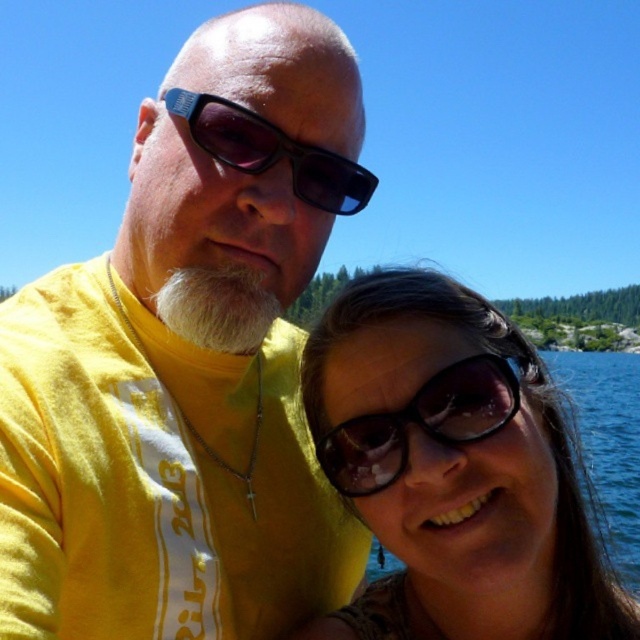
Question: Which of these objects is positioned closest to the matte black sunglasses at upper center?

Choices:
 (A) white fuzzy beard at center
 (B) sunglasses at center
 (C) yellow matte shirt at upper left
 (D) matte black sunglasses at center

Answer: (C)

Question: Is matte black sunglasses at center positioned at the back of matte black sunglasses at upper center?

Choices:
 (A) no
 (B) yes

Answer: (A)

Question: Does matte black sunglasses at center have a larger size compared to matte black sunglasses at upper center?

Choices:
 (A) no
 (B) yes

Answer: (B)

Question: Can you confirm if yellow matte shirt at upper left is positioned below matte black sunglasses at center?

Choices:
 (A) yes
 (B) no

Answer: (B)

Question: Which of the following is the closest to the observer?

Choices:
 (A) yellow matte shirt at upper left
 (B) matte black sunglasses at center
 (C) matte black sunglasses at upper center
 (D) white fuzzy beard at center

Answer: (A)

Question: Which of the following is the farthest from the observer?

Choices:
 (A) (272, 20)
 (B) (340, 428)

Answer: (A)